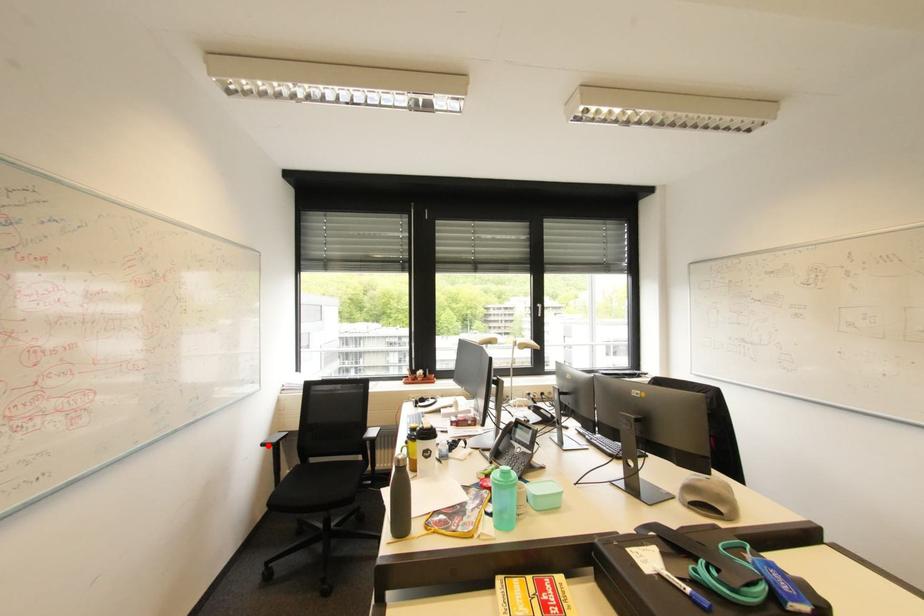
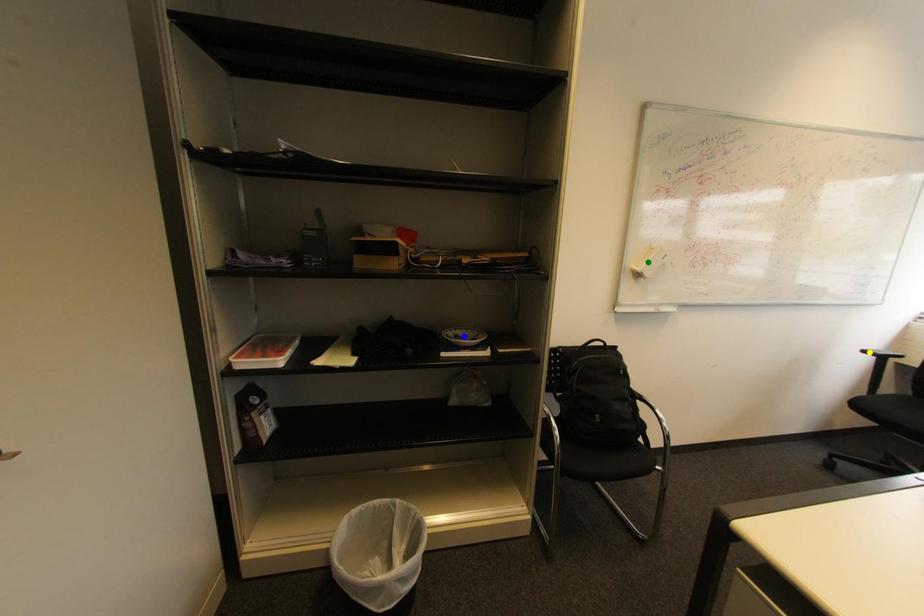
Question: I am providing you with two images of the same scene from different viewpoints. A red point is marked on the first image. You are given multiple points on the second image. Which spot in image 2 lines up with the point in image 1?

Choices:
 (A) yellow point
 (B) green point
 (C) blue point

Answer: (A)